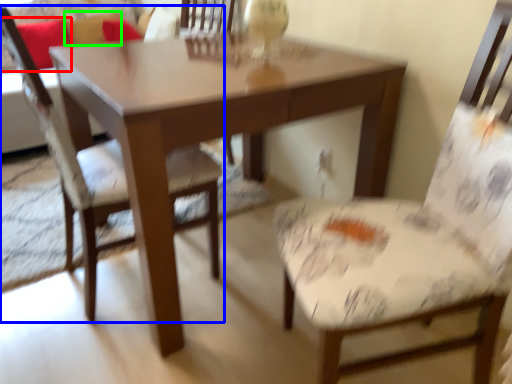
Question: Which object is positioned farthest from pillow (highlighted by a red box)? Select from chair (highlighted by a blue box) and pillow (highlighted by a green box).

Choices:
 (A) chair
 (B) pillow

Answer: (A)